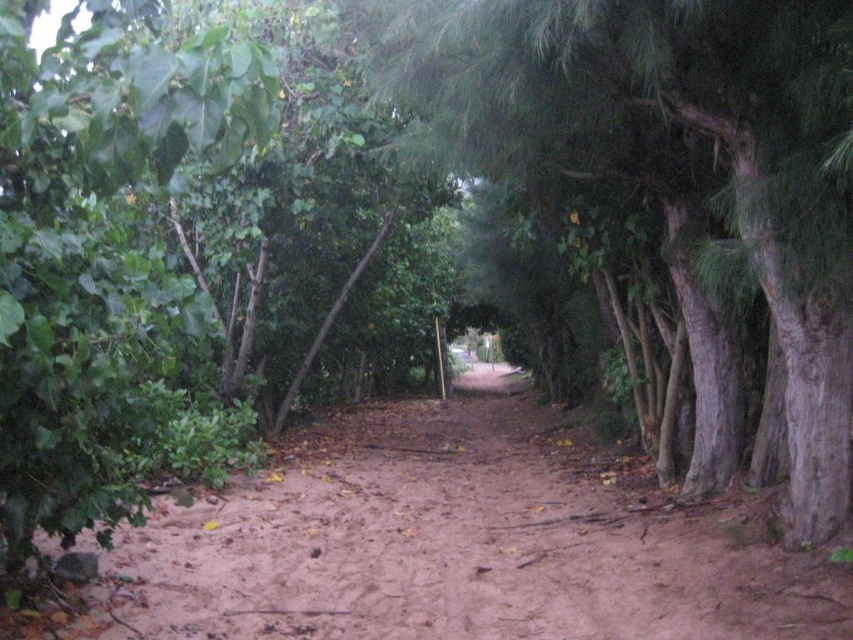
You are a hiker standing on the dirt path at center. You want to take a photo of the green rough bark tree at center. In which direction should you turn to face the tree?

The green rough bark tree at center is to the left of the dirt path at center, so you should turn to your left to face the tree.

From the picture: You are walking along the natural pathway and want to reach a specific destination. You notice two points marked on your map. The first point is at coordinates point (639, 544) and the second is at point (788, 273). According to the scene description, which point is further away from your current position on the path?

Point (639, 544) is behind point (788, 273), so it is further away from your current position on the path.

You are a hiker walking along the dirt path at center. You notice a green rough bark tree at center nearby. Which one is closer to you, the tree or the path?

The dirt path at center is closer to you because the green rough bark tree at center is smaller than it, indicating it is farther away.